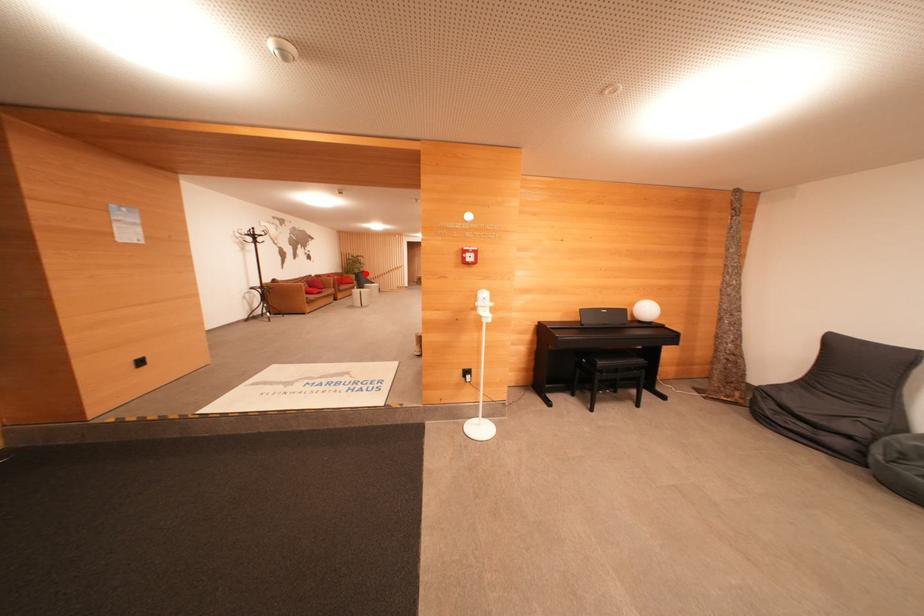
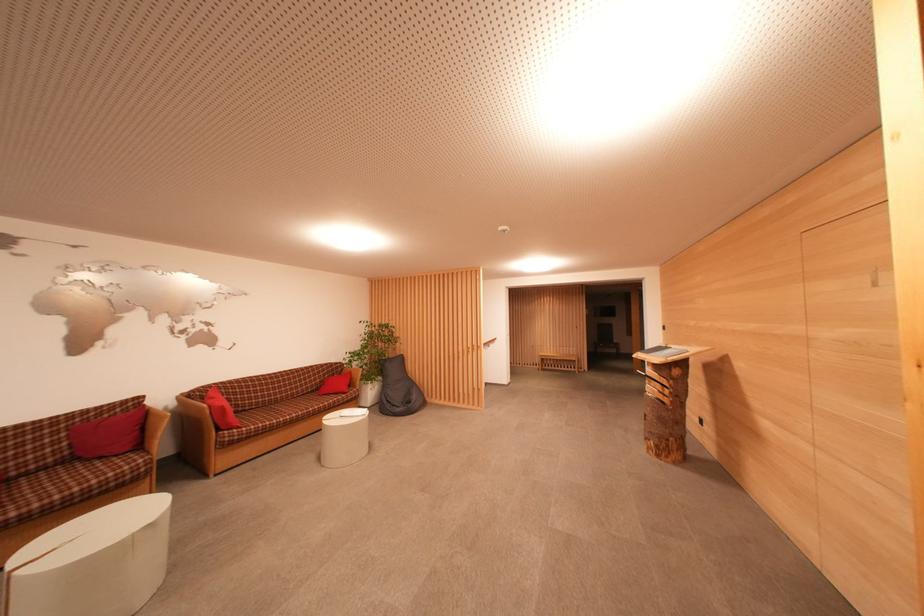
Locate, in the second image, the point that corresponds to the highlighted location in the first image.

(402, 357)